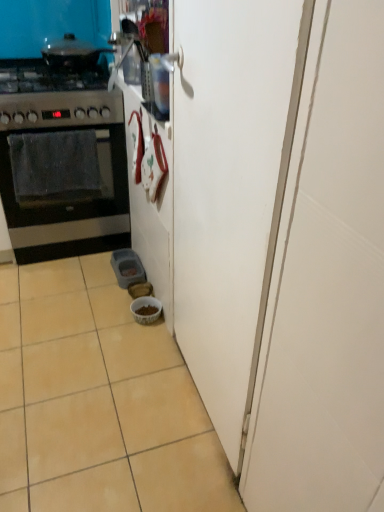
This screenshot has width=384, height=512. What are the coordinates of `free space that is in between white matte door at center and white glossy bowl at lower center` in the screenshot? It's located at (165, 367).